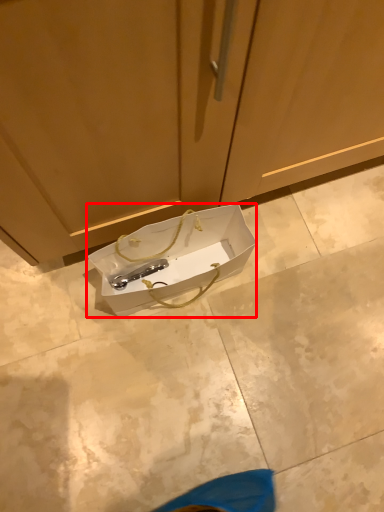
Question: Where is box (annotated by the red box) located in relation to cabinetry in the image?

Choices:
 (A) right
 (B) left

Answer: (B)